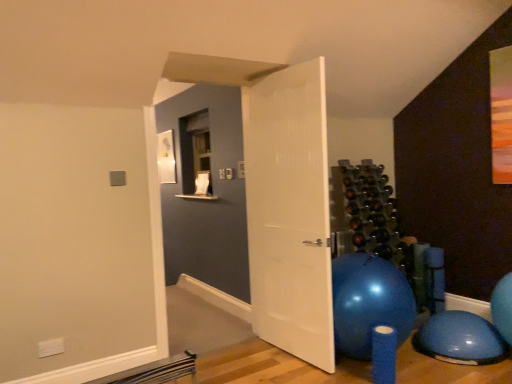
I want to click on white textured door at center, so click(x=289, y=211).

What do you see at coordinates (289, 211) in the screenshot? I see `white textured door at center` at bounding box center [289, 211].

The width and height of the screenshot is (512, 384). Identify the location of blue rubber ball at lower right. (460, 339).

This screenshot has width=512, height=384. Describe the element at coordinates (460, 339) in the screenshot. I see `blue rubber ball at lower right` at that location.

At what (x,y) coordinates should I click in order to perform the action: click on white textured door at center. Please return your answer as a coordinate pair (x, y). This screenshot has height=384, width=512. Looking at the image, I should click on (289, 211).

In the image, is blue rubber ball at lower right on the left side or the right side of white textured door at center?

blue rubber ball at lower right is to the right of white textured door at center.

Considering their positions, is blue rubber ball at lower right located in front of or behind white textured door at center?

Visually, blue rubber ball at lower right is located behind white textured door at center.

Considering the positions of point (467, 356) and point (294, 187), is point (467, 356) closer or farther from the camera than point (294, 187)?

Clearly, point (467, 356) is closer to the camera than point (294, 187).

From the image's perspective, which is below, blue rubber ball at lower right or white textured door at center?

blue rubber ball at lower right appears lower in the image.

From a real-world perspective, is blue rubber ball at lower right positioned over white textured door at center based on gravity?

No, from a real-world perspective, blue rubber ball at lower right is not over white textured door at center

Is blue rubber ball at lower right thinner than white textured door at center?

No.

In terms of height, does blue rubber ball at lower right look taller or shorter compared to white textured door at center?

Considering their sizes, blue rubber ball at lower right has less height than white textured door at center.

Between blue rubber ball at lower right and white textured door at center, which one has larger size?

white textured door at center.

Is white textured door at center surrounded by blue rubber ball at lower right?

No, white textured door at center is not surrounded by blue rubber ball at lower right.

Is blue rubber ball at lower right with white textured door at center?

No, blue rubber ball at lower right is not in contact with white textured door at center.

Is blue rubber ball at lower right turned away from white textured door at center?

blue rubber ball at lower right is not turned away from white textured door at center.

How many degrees apart are the facing directions of blue rubber ball at lower right and white textured door at center?

The angle between the facing direction of blue rubber ball at lower right and the facing direction of white textured door at center is 83.3 degrees.

Measure the distance from blue rubber ball at lower right to white textured door at center.

blue rubber ball at lower right is 1.16 meters from white textured door at center.

Where is `door in front of the blue rubber ball at lower right`? The height and width of the screenshot is (384, 512). door in front of the blue rubber ball at lower right is located at coordinates (289, 211).

Based on their positions, is white textured door at center located to the left or right of blue rubber ball at lower right?

Clearly, white textured door at center is on the left of blue rubber ball at lower right in the image.

Is white textured door at center in front of or behind blue rubber ball at lower right in the image?

white textured door at center is in front of blue rubber ball at lower right.

Considering the positions of point (294, 110) and point (481, 334), is point (294, 110) closer or farther from the camera than point (481, 334)?

Clearly, point (294, 110) is more distant from the camera than point (481, 334).

From the image's perspective, which is below, white textured door at center or blue rubber ball at lower right?

blue rubber ball at lower right, from the image's perspective.

From a real-world perspective, which object stands above the other?

white textured door at center, from a real-world perspective.

Looking at their sizes, would you say white textured door at center is wider or thinner than blue rubber ball at lower right?

white textured door at center is thinner than blue rubber ball at lower right.

Who is taller, white textured door at center or blue rubber ball at lower right?

white textured door at center is taller.

Does white textured door at center have a larger size compared to blue rubber ball at lower right?

Yes.

Is blue rubber ball at lower right inside white textured door at center?

Definitely not — blue rubber ball at lower right is not inside white textured door at center.

Would you say white textured door at center is a long distance from blue rubber ball at lower right?

That's right, there is a large distance between white textured door at center and blue rubber ball at lower right.

Consider the image. Is white textured door at center facing away from blue rubber ball at lower right?

white textured door at center does not have its back to blue rubber ball at lower right.

Find the location of `balloon on the right of white textured door at center`. balloon on the right of white textured door at center is located at coordinates (460, 339).

Identify the location of balloon below the white textured door at center (from a real-world perspective). The height and width of the screenshot is (384, 512). (460, 339).

The width and height of the screenshot is (512, 384). Identify the location of door lying above the blue rubber ball at lower right (from the image's perspective). (289, 211).